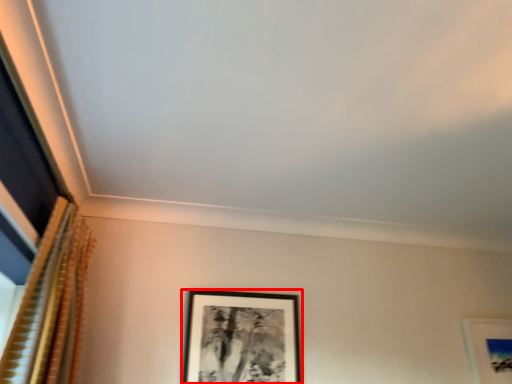
Question: From the image, what is the correct spatial relationship of picture frame (annotated by the red box) in relation to curtain?

Choices:
 (A) left
 (B) right

Answer: (B)